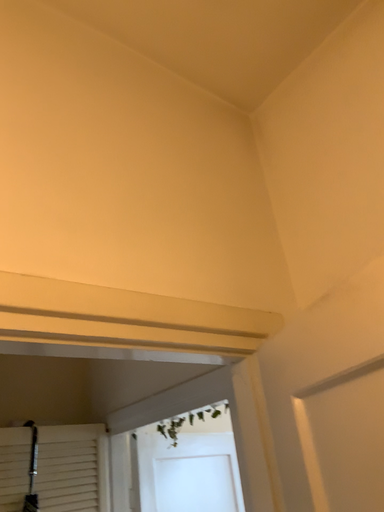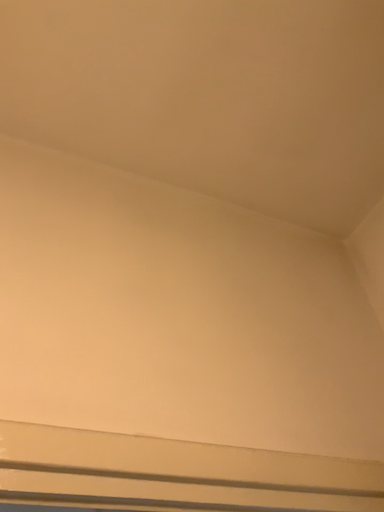
Question: Which way did the camera rotate in the video?

Choices:
 (A) rotated upward
 (B) rotated downward

Answer: (A)